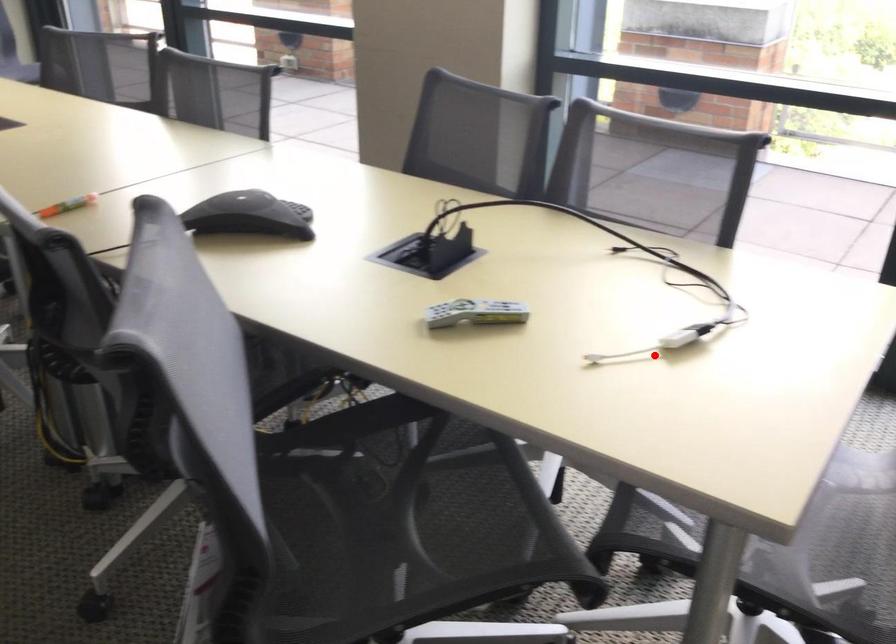
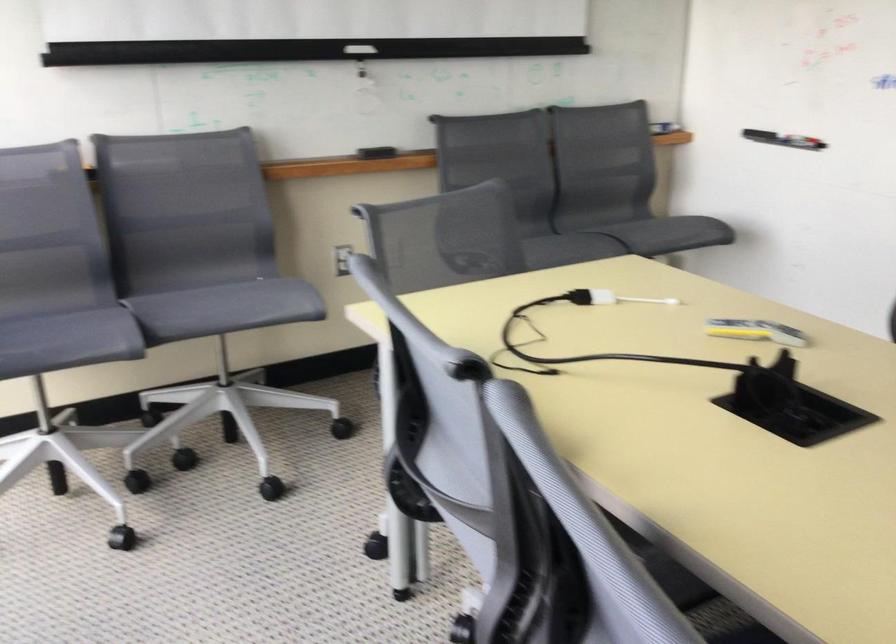
Find the pixel in the second image that matches the highlighted location in the first image.

(610, 298)